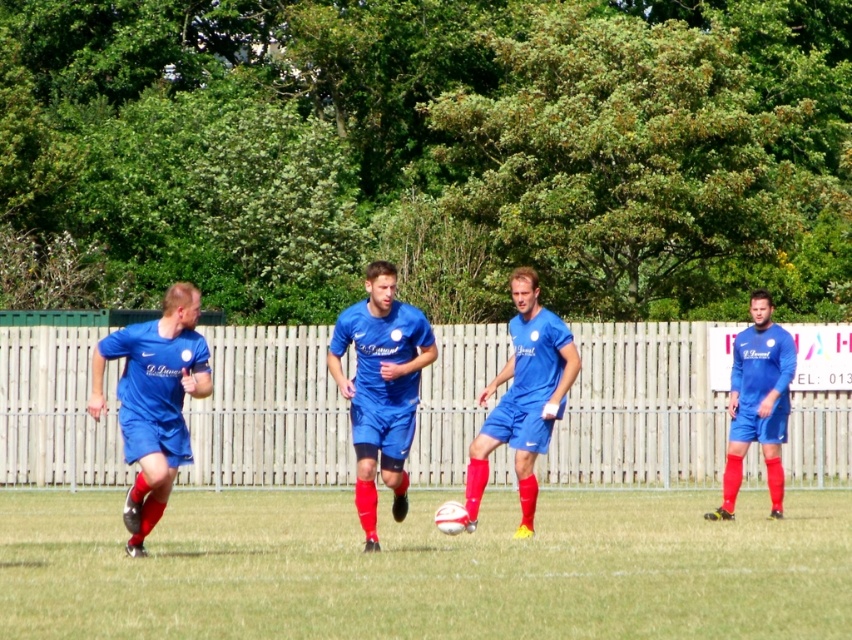
Can you confirm if green grass at center is positioned to the left of blue matte soccer player at center?

No, green grass at center is not to the left of blue matte soccer player at center.

Identify the location of green grass at center. This screenshot has width=852, height=640. (426, 566).

This screenshot has height=640, width=852. Describe the element at coordinates (426, 566) in the screenshot. I see `green grass at center` at that location.

Locate an element on the screen. This screenshot has width=852, height=640. green grass at center is located at coordinates [x=426, y=566].

Is green grass at center to the right of blue fabric soccer team at center from the viewer's perspective?

Indeed, green grass at center is positioned on the right side of blue fabric soccer team at center.

Does green grass at center appear on the left side of blue fabric soccer team at center?

In fact, green grass at center is to the right of blue fabric soccer team at center.

Who is more forward, (286, 563) or (376, 417)?

Point (286, 563) is in front.

Where is `green grass at center`? green grass at center is located at coordinates (426, 566).

Can you confirm if matte blue shorts at left is thinner than blue matte soccer player at center?

No.

Which is below, matte blue shorts at left or blue matte soccer player at center?

blue matte soccer player at center

Between point (142, 412) and point (364, 401), which one is positioned in front?

Positioned in front is point (142, 412).

This screenshot has height=640, width=852. In order to click on matte blue shorts at left in this screenshot , I will do `click(153, 401)`.